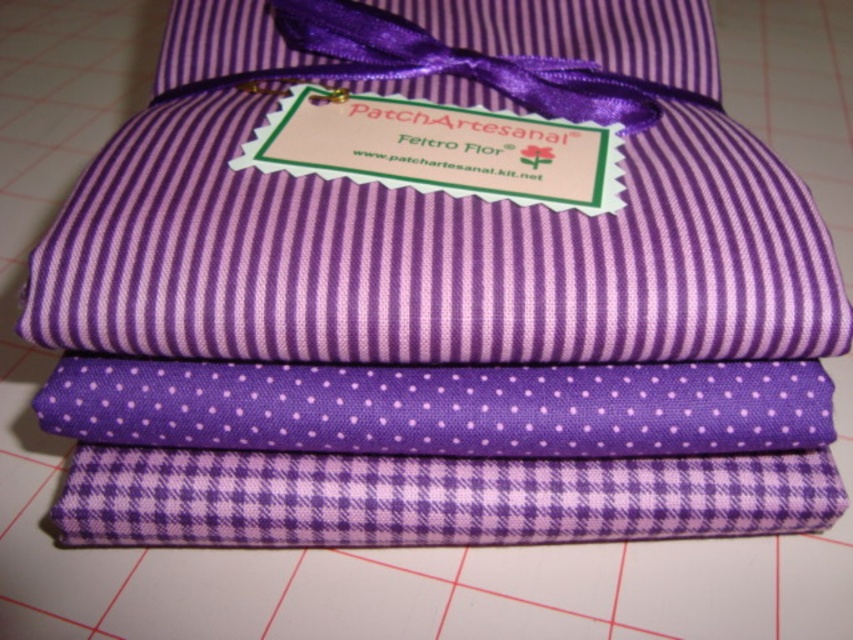
You are organizing fabrics on a shelf and need to place the matte purple fabric at center and the purple dotted fabric at center side by side. Based on their widths, which one should you place first to ensure they fit properly?

The matte purple fabric at center might be wider than purple dotted fabric at center, so you should place the wider matte purple fabric at center first to ensure they fit properly.

You are organizing fabrics on a cutting mat with a grid. The purple dotted fabric at center is placed at point 0.637, 0.519. If you need to place another fabric exactly 0.2 units to the right of it, what would be the new coordinates?

The new coordinates would be [442,534] because adding 0.2 to the x coordinate of the purple dotted fabric at center moves it right while keeping the y coordinate the same.

From the picture: You are organizing fabrics on a cutting mat and see the purple dotted fabric at center and the purple checkered fabric at bottom. Which fabric is placed higher up?

The purple dotted fabric at center is located above the purple checkered fabric at bottom, so it is placed higher up.